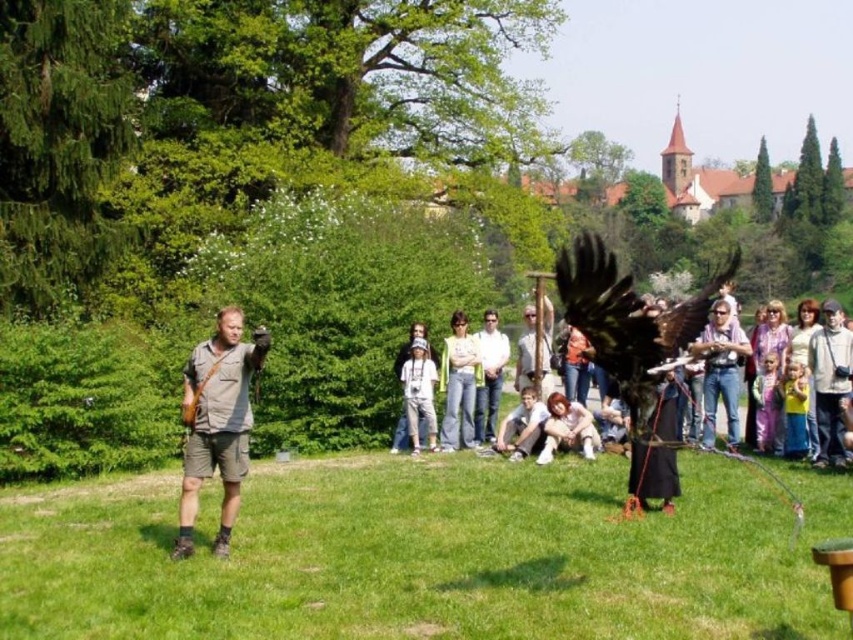
You are a photographer standing behind the group of spectators. You want to take a photo of the shiny black falcon at center and the light brown hair at lower center in the same frame. The camera you are using has a maximum focus range of 3.5 meters. Will both subjects be in focus?

The shiny black falcon at center and light brown hair at lower center are 3.75 meters apart from each other. Since the maximum focus range is 3.5 meters, the distance between them exceeds the camera limit, so both subjects cannot be in focus simultaneously.

You are a photographer standing at the edge of the crowd. You want to take a photo of the shiny black falcon at center. To ensure the falcon is in the center of your photo, where should you aim your camera?

You should aim your camera at the coordinates point (635, 353) to center the shiny black falcon at center in your photo.

You are a photographer at the event, and you want to take a photo of the light gray cotton shirt at center and the light brown hair at lower center. Which object should you focus on first to ensure both are in focus?

You should focus on the light gray cotton shirt at center first because it is closer to you than the light brown hair at lower center, so focusing on the closer object will help both be in focus.